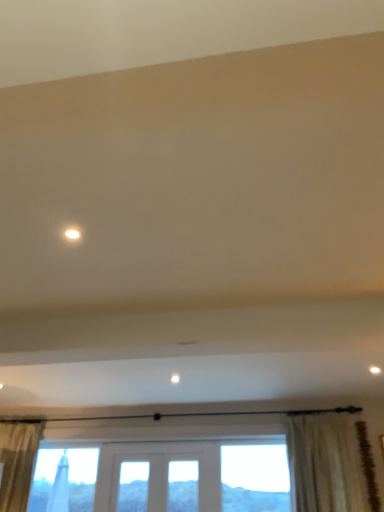
Image resolution: width=384 pixels, height=512 pixels. What are the coordinates of `white textured curtain at lower right` in the screenshot? It's located at (325, 464).

The image size is (384, 512). Describe the element at coordinates (325, 464) in the screenshot. I see `white textured curtain at lower right` at that location.

Measure the distance between point (72, 228) and camera.

Point (72, 228) and camera are 6.92 feet apart from each other.

Identify the location of matte white light at upper center. The height and width of the screenshot is (512, 384). (72, 234).

The height and width of the screenshot is (512, 384). Describe the element at coordinates (72, 234) in the screenshot. I see `matte white light at upper center` at that location.

Where is `white textured curtain at lower right`? The image size is (384, 512). white textured curtain at lower right is located at coordinates (325, 464).

Is matte white light at upper center at the right side of white textured curtain at lower right?

Incorrect, matte white light at upper center is not on the right side of white textured curtain at lower right.

From the picture: Does matte white light at upper center lie in front of white textured curtain at lower right?

Yes, matte white light at upper center is in front of white textured curtain at lower right.

Does point (74, 226) appear closer or farther from the camera than point (349, 490)?

Point (74, 226) is closer to the camera than point (349, 490).

From the picture: From the image's perspective, is matte white light at upper center under white textured curtain at lower right?

Incorrect, from the image's perspective, matte white light at upper center is higher than white textured curtain at lower right.

From a real-world perspective, who is located higher, matte white light at upper center or white textured curtain at lower right?

From a 3D spatial view, matte white light at upper center is above.

Considering the sizes of matte white light at upper center and white textured curtain at lower right in the image, is matte white light at upper center wider or thinner than white textured curtain at lower right?

matte white light at upper center is thinner than white textured curtain at lower right.

Is matte white light at upper center taller or shorter than white textured curtain at lower right?

matte white light at upper center is shorter than white textured curtain at lower right.

In the scene shown: Between matte white light at upper center and white textured curtain at lower right, which one has smaller size?

Smaller between the two is matte white light at upper center.

Is matte white light at upper center situated inside white textured curtain at lower right or outside?

matte white light at upper center is not enclosed by white textured curtain at lower right.

Are matte white light at upper center and white textured curtain at lower right far apart?

Yes, matte white light at upper center and white textured curtain at lower right are located far from each other.

Is matte white light at upper center oriented away from white textured curtain at lower right?

No, matte white light at upper center is not facing the opposite direction of white textured curtain at lower right.

How many degrees apart are the facing directions of matte white light at upper center and white textured curtain at lower right?

The facing directions of matte white light at upper center and white textured curtain at lower right are 93.5 degrees apart.

You are a GUI agent. You are given a task and a screenshot of the screen. Output one action in this format:
    pyautogui.click(x=<x>, y=<y>)
    Task: Click on the light above the white textured curtain at lower right (from the image's perspective)
    The width and height of the screenshot is (384, 512).
    Given the screenshot: What is the action you would take?
    pyautogui.click(x=72, y=234)

Would you say white textured curtain at lower right is to the left or to the right of matte white light at upper center in the picture?

From the image, it's evident that white textured curtain at lower right is to the right of matte white light at upper center.

Does white textured curtain at lower right lie behind matte white light at upper center?

Yes, white textured curtain at lower right is further from the camera.

Which point is more forward, (x=365, y=494) or (x=75, y=227)?

The point (x=75, y=227) is closer to the camera.

From the image's perspective, which one is positioned higher, white textured curtain at lower right or matte white light at upper center?

matte white light at upper center is shown above in the image.

From a real-world perspective, is white textured curtain at lower right above or below matte white light at upper center?

white textured curtain at lower right is below matte white light at upper center.

Which object is wider, white textured curtain at lower right or matte white light at upper center?

Wider between the two is white textured curtain at lower right.

Considering the sizes of objects white textured curtain at lower right and matte white light at upper center in the image provided, who is shorter, white textured curtain at lower right or matte white light at upper center?

With less height is matte white light at upper center.

Who is smaller, white textured curtain at lower right or matte white light at upper center?

matte white light at upper center is smaller.

Is white textured curtain at lower right spatially inside matte white light at upper center, or outside of it?

white textured curtain at lower right is outside matte white light at upper center.

Are white textured curtain at lower right and matte white light at upper center far apart?

Yes, white textured curtain at lower right and matte white light at upper center are located far from each other.

Is white textured curtain at lower right turned away from matte white light at upper center?

No, white textured curtain at lower right is not facing away from matte white light at upper center.

Can you tell me how much white textured curtain at lower right and matte white light at upper center differ in facing direction?

93.5 degrees separate the facing orientations of white textured curtain at lower right and matte white light at upper center.

How distant is white textured curtain at lower right from matte white light at upper center?

12.04 feet.

In order to click on curtain below the matte white light at upper center (from a real-world perspective) in this screenshot , I will do `click(325, 464)`.

This screenshot has height=512, width=384. I want to click on light above the white textured curtain at lower right (from the image's perspective), so point(72,234).

Where is `light that is on the left side of white textured curtain at lower right`? This screenshot has width=384, height=512. light that is on the left side of white textured curtain at lower right is located at coordinates (72, 234).